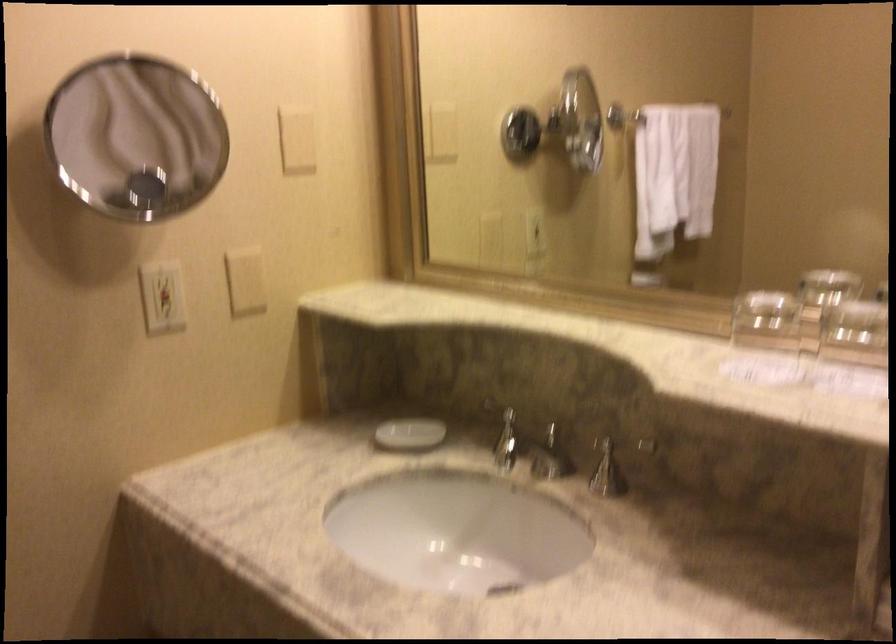
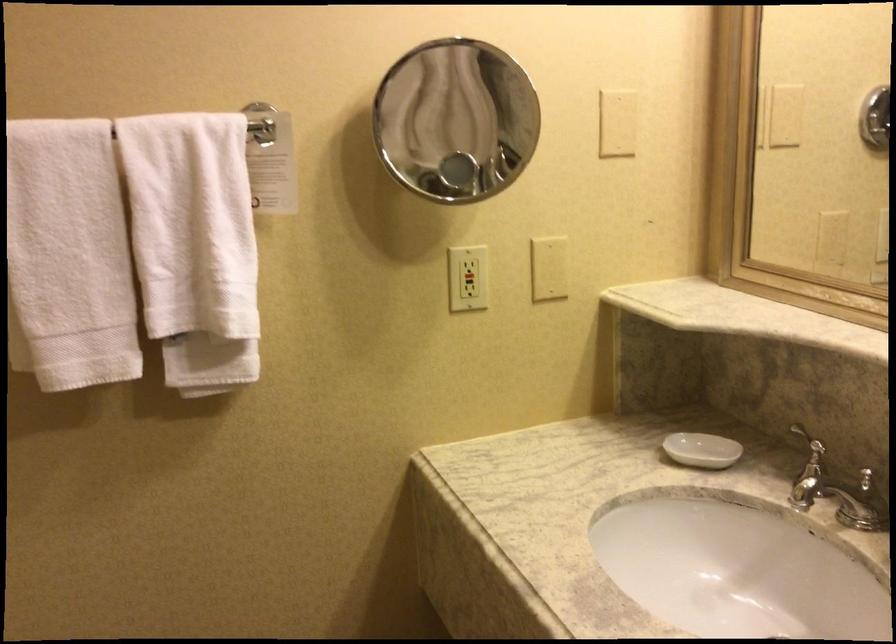
Locate, in the second image, the point that corresponds to point 161,297 in the first image.

(467, 278)